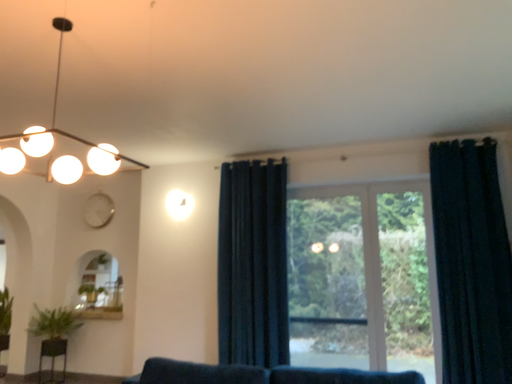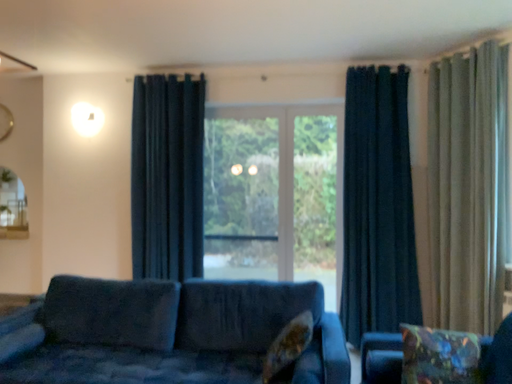
Question: How did the camera likely rotate when shooting the video?

Choices:
 (A) rotated left
 (B) rotated right

Answer: (B)